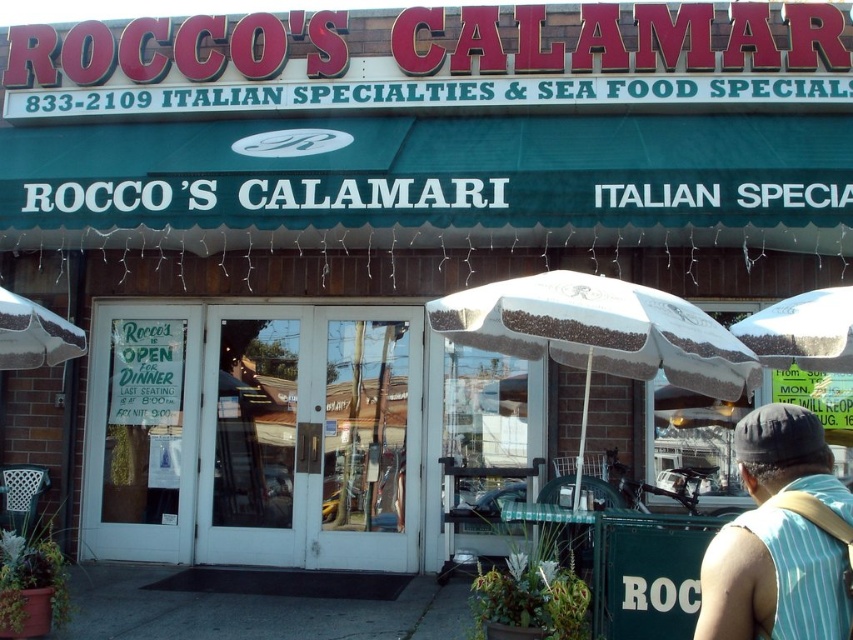
You are a customer standing in front of the restaurant entrance. You see a white textured umbrella at center and a striped sleeveless shirt at lower right. Which object is closer to you?

The white textured umbrella at center is closer to you than the striped sleeveless shirt at lower right.

You are a customer waiting outside the restaurant and you have a striped sleeveless shirt at lower right. You want to use the white textured umbrella at center to protect yourself from the rain. Can the umbrella cover your entire shirt?

The white textured umbrella at center is bigger than striped sleeveless shirt at lower right, so yes, the umbrella can cover your entire shirt.